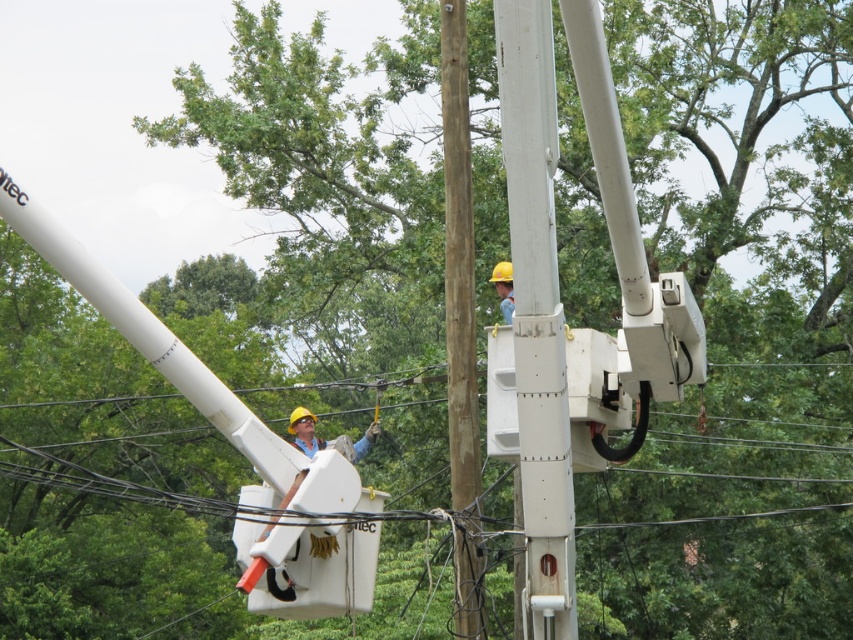
You are a utility worker standing next to the brown wood telegraph pole at center. You need to place a tool on the yellow hard hat at upper center. Can you reach it without moving the bucket truck?

The brown wood telegraph pole at center and yellow hard hat at upper center are 6.70 feet apart from each other. Since the distance is more than an average person can reach, you cannot reach the yellow hard hat at upper center from the brown wood telegraph pole at center without moving the bucket truck.

Based on the scene description, where is the brown wood telegraph pole at center located in terms of coordinates?

The brown wood telegraph pole at center is located at coordinates (460, 324).